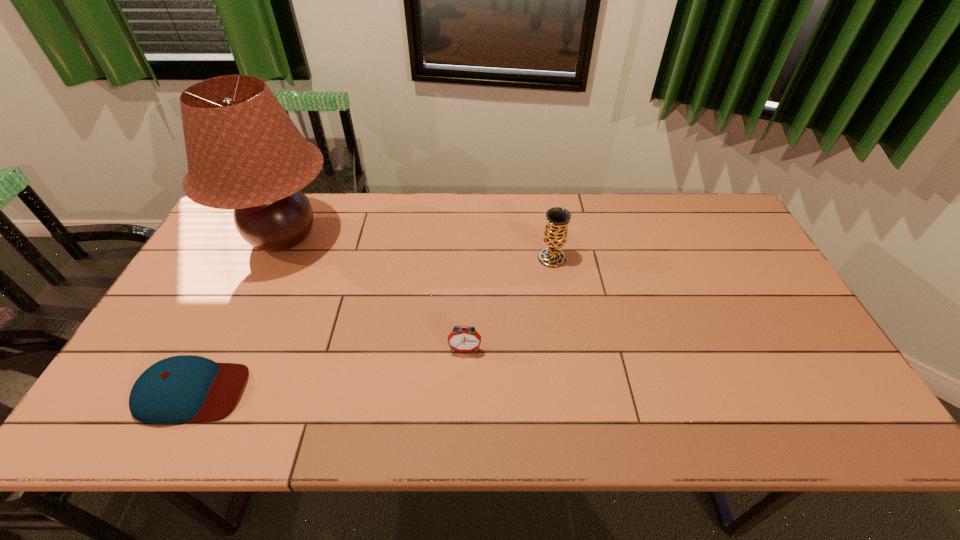
In the image, there is a desktop. Identify the location of vacant space at the right edge. The image size is (960, 540). (784, 334).

The image size is (960, 540). Identify the location of blank space at the far right corner. (683, 218).

Image resolution: width=960 pixels, height=540 pixels. I want to click on blank region between the second tallest object and the nearest object, so click(372, 325).

Identify the location of vacant point located between the tallest object and the third object from left to right. (374, 294).

Identify the location of free space between the third shortest object and the baseball cap. (372, 325).

At what (x,y) coordinates should I click in order to perform the action: click on blank region between the baseball cap and the lampshade. Please return your answer as a coordinate pair (x, y). The height and width of the screenshot is (540, 960). Looking at the image, I should click on (238, 315).

Find the location of a particular element. blank region between the tallest object and the third shortest object is located at coordinates (418, 248).

At what (x,y) coordinates should I click in order to perform the action: click on free space that is in between the tallest object and the second tallest object. Please return your answer as a coordinate pair (x, y). Looking at the image, I should click on (418, 248).

The image size is (960, 540). I want to click on vacant space in between the tallest object and the third shortest object, so click(x=418, y=248).

Where is `vacant area between the baseball cap and the second tallest object`? This screenshot has width=960, height=540. vacant area between the baseball cap and the second tallest object is located at coordinates [x=372, y=325].